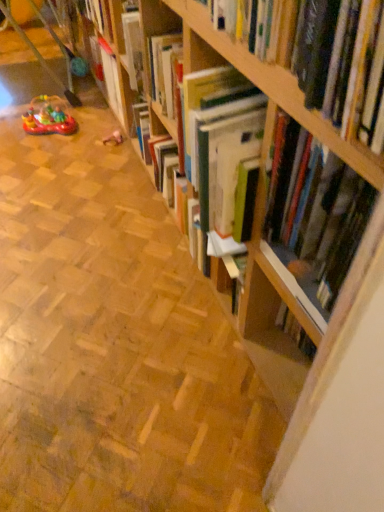
Find the location of a particular element. Image resolution: width=384 pixels, height=512 pixels. vacant space to the left of wooden bookcase at upper right is located at coordinates (88, 465).